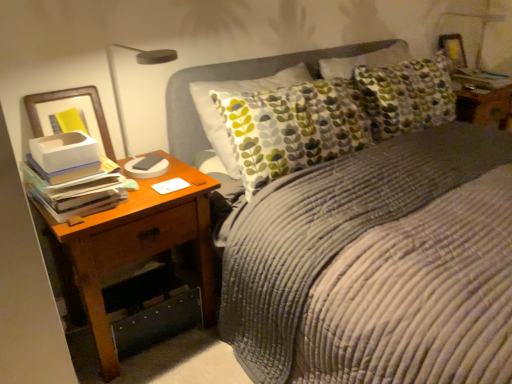
In order to face white paper stack at left, should I rotate leftwards or rightwards?

You should look left and rotate roughly 23.456 degrees.

What do you see at coordinates (132, 248) in the screenshot? The height and width of the screenshot is (384, 512). I see `brown wood nightstand at left` at bounding box center [132, 248].

Where is `white paper stack at left`? The height and width of the screenshot is (384, 512). white paper stack at left is located at coordinates pos(72,179).

What's the angular difference between corduroy fabric bed at center and brown wood nightstand at left's facing directions?

The angular difference between corduroy fabric bed at center and brown wood nightstand at left is 0.272 degrees.

Is brown wood nightstand at left at the back of corduroy fabric bed at center?

corduroy fabric bed at center is not turned away from brown wood nightstand at left.

Considering the relative sizes of corduroy fabric bed at center and brown wood nightstand at left in the image provided, is corduroy fabric bed at center shorter than brown wood nightstand at left?

No.

Which is more to the left, corduroy fabric bed at center or brown wood nightstand at left?

brown wood nightstand at left is more to the left.

From a real-world perspective, is white paper stack at left over brown wood nightstand at left?

Correct, in the physical world, white paper stack at left is higher than brown wood nightstand at left.

Can you confirm if white paper stack at left is smaller than brown wood nightstand at left?

Yes.

Which of these two, white paper stack at left or brown wood nightstand at left, stands shorter?

With less height is white paper stack at left.

Considering the relative sizes of white paper stack at left and brown wood nightstand at left in the image provided, is white paper stack at left thinner than brown wood nightstand at left?

Yes, white paper stack at left is thinner than brown wood nightstand at left.

Is the surface of white paper stack at left in direct contact with corduroy fabric bed at center?

They are not placed beside each other.

From the image's perspective, which is below, white paper stack at left or corduroy fabric bed at center?

From the image's view, white paper stack at left is below.

Between white paper stack at left and corduroy fabric bed at center, which one has smaller width?

white paper stack at left.

From the image's perspective, is corduroy fabric bed at center located above white paper stack at left?

Yes, from the image's perspective, corduroy fabric bed at center is above white paper stack at left.

Considering the sizes of corduroy fabric bed at center and white paper stack at left in the image, is corduroy fabric bed at center wider or thinner than white paper stack at left?

In the image, corduroy fabric bed at center appears to be wider than white paper stack at left.

Locate an element on the screen. The width and height of the screenshot is (512, 384). bed that is in front of the white paper stack at left is located at coordinates (406, 274).

Is corduroy fabric bed at center to the left of white paper stack at left from the viewer's perspective?

In fact, corduroy fabric bed at center is to the right of white paper stack at left.

Does point (115, 255) come in front of point (68, 180)?

No, (115, 255) is behind (68, 180).

How much distance is there between brown wood nightstand at left and white paper stack at left?

6.70 inches.

From the picture: Can white paper stack at left be found inside brown wood nightstand at left?

Definitely not — white paper stack at left is not inside brown wood nightstand at left.

Considering the relative sizes of brown wood nightstand at left and white paper stack at left in the image provided, is brown wood nightstand at left shorter than white paper stack at left?

No, brown wood nightstand at left is not shorter than white paper stack at left.

Considering the relative sizes of brown wood nightstand at left and corduroy fabric bed at center in the image provided, is brown wood nightstand at left shorter than corduroy fabric bed at center?

Yes.

Is brown wood nightstand at left oriented towards corduroy fabric bed at center?

Yes, brown wood nightstand at left is oriented towards corduroy fabric bed at center.

How many degrees apart are the facing directions of brown wood nightstand at left and corduroy fabric bed at center?

The facing directions of brown wood nightstand at left and corduroy fabric bed at center are 0.272 degrees apart.

From the image's perspective, which is below, brown wood nightstand at left or corduroy fabric bed at center?

brown wood nightstand at left.

Image resolution: width=512 pixels, height=384 pixels. I want to click on bed in front of the brown wood nightstand at left, so 406,274.

In the image, there is a white paper stack at left. Identify the location of nightstand below it (from the image's perspective). coord(132,248).

Which object lies nearer to the anchor point corduroy fabric bed at center, brown wood nightstand at left or white paper stack at left?

brown wood nightstand at left lies closer to corduroy fabric bed at center than the other object.

Based on their spatial positions, is corduroy fabric bed at center or white paper stack at left further from brown wood nightstand at left?

corduroy fabric bed at center lies further to brown wood nightstand at left than the other object.

Which object lies further to the anchor point white paper stack at left, corduroy fabric bed at center or brown wood nightstand at left?

corduroy fabric bed at center is further to white paper stack at left.

Looking at the image, which one is located closer to brown wood nightstand at left, white paper stack at left or corduroy fabric bed at center?

Among the two, white paper stack at left is located nearer to brown wood nightstand at left.

Based on their spatial positions, is brown wood nightstand at left or corduroy fabric bed at center closer to white paper stack at left?

brown wood nightstand at left is closer to white paper stack at left.

Estimate the real-world distances between objects in this image. Which object is further from corduroy fabric bed at center, white paper stack at left or brown wood nightstand at left?

white paper stack at left.

I want to click on nightstand between white paper stack at left and corduroy fabric bed at center, so click(132, 248).